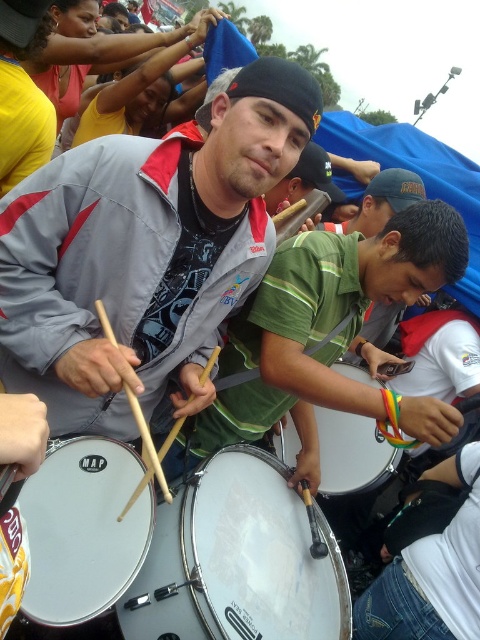
From the picture: Who is positioned more to the left, white drumhead at center or white drum at center?

Positioned to the left is white drumhead at center.

Locate an element on the screen. white drumhead at center is located at coordinates (84, 529).

You are a GUI agent. You are given a task and a screenshot of the screen. Output one action in this format:
    pyautogui.click(x=<x>, y=<y>)
    Task: Click on the white drumhead at center
    The height and width of the screenshot is (640, 480).
    Given the screenshot: What is the action you would take?
    pyautogui.click(x=84, y=529)

Identify the location of white drumhead at center. (84, 529).

Can you confirm if gray fabric jacket at center is positioned above white drumhead at center?

Yes.

Which is in front, point (144, 330) or point (41, 557)?

Point (41, 557)

Between point (194, 400) and point (20, 499), which one is positioned in front?

Point (20, 499) is in front.

This screenshot has height=640, width=480. Find the location of `gray fabric jacket at center`. gray fabric jacket at center is located at coordinates (144, 252).

Is white drum at center closer to the viewer compared to green matte shirt at center?

Yes, it is in front of green matte shirt at center.

Who is more distant from viewer, (334, 445) or (425, 300)?

Positioned behind is point (425, 300).

The width and height of the screenshot is (480, 640). What are the coordinates of `white drum at center` in the screenshot? It's located at (351, 452).